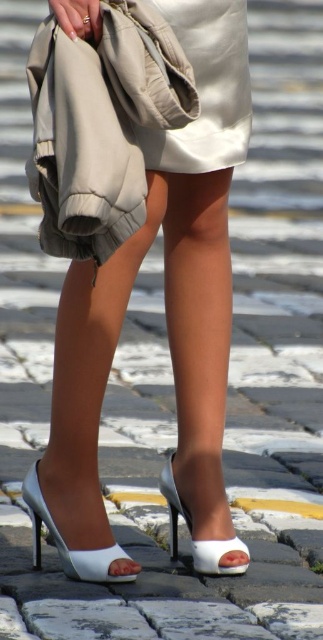
Question: Which object is farther from the camera taking this photo?

Choices:
 (A) white leather sandal at lower center
 (B) white leather sandal at center
 (C) beige quilted fabric trench coat at upper left
 (D) white leather high heels at center

Answer: (B)

Question: Does white leather sandal at lower center have a smaller size compared to white leather sandal at center?

Choices:
 (A) yes
 (B) no

Answer: (B)

Question: Which of the following is the closest to the observer?

Choices:
 (A) (239, 554)
 (B) (81, 412)

Answer: (A)

Question: Is white leather high heels at center smaller than beige quilted fabric trench coat at upper left?

Choices:
 (A) yes
 (B) no

Answer: (B)

Question: Which point is closer to the camera taking this photo?

Choices:
 (A) (42, 520)
 (B) (166, 497)

Answer: (A)

Question: Is beige quilted fabric trench coat at upper left positioned before white leather sandal at center?

Choices:
 (A) yes
 (B) no

Answer: (A)